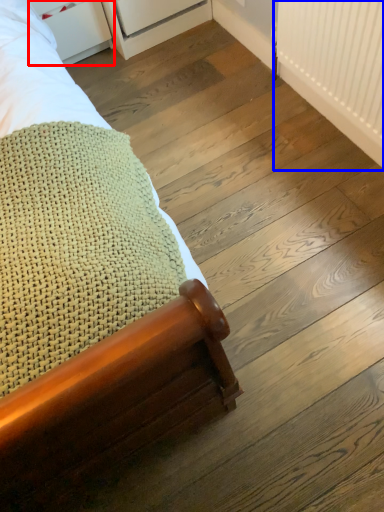
Question: Which of the following is the closest to the observer, drawer (highlighted by a red box) or radiator (highlighted by a blue box)?

Choices:
 (A) drawer
 (B) radiator

Answer: (B)